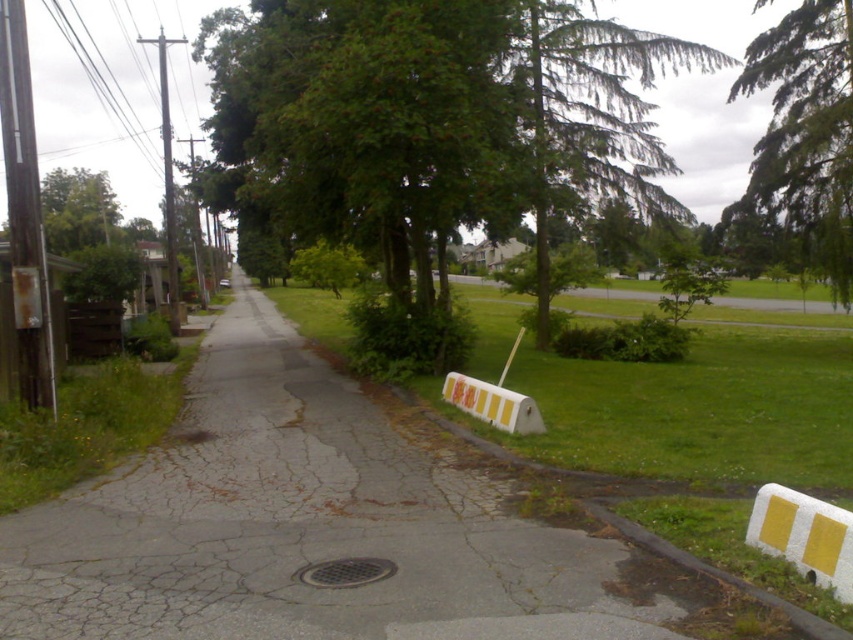
Between green needle-like at upper center and yellow matte barricade at center, which one appears on the left side from the viewer's perspective?

yellow matte barricade at center

Does green needle-like at upper center appear on the left side of yellow matte barricade at center?

No, green needle-like at upper center is not to the left of yellow matte barricade at center.

Who is more forward, [525,10] or [517,396]?

Point [517,396] is in front.

The height and width of the screenshot is (640, 853). Identify the location of green needle-like at upper center. (590, 115).

Is point (543, 401) in front of point (805, 552)?

No, it is not.

Find the location of `green grass at center`. green grass at center is located at coordinates (689, 410).

Is green leafy tree at center thinner than yellow matte barricade at center?

In fact, green leafy tree at center might be wider than yellow matte barricade at center.

Who is more forward, [218,10] or [498,394]?

Point [498,394]

Locate an element on the screen. green leafy tree at center is located at coordinates (432, 116).